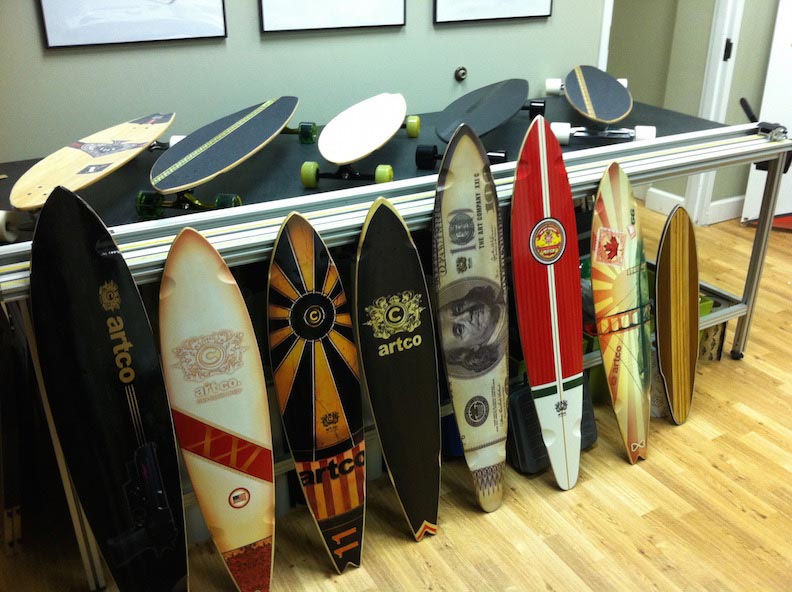
This screenshot has width=792, height=592. Find the location of `door`. door is located at coordinates (777, 85).